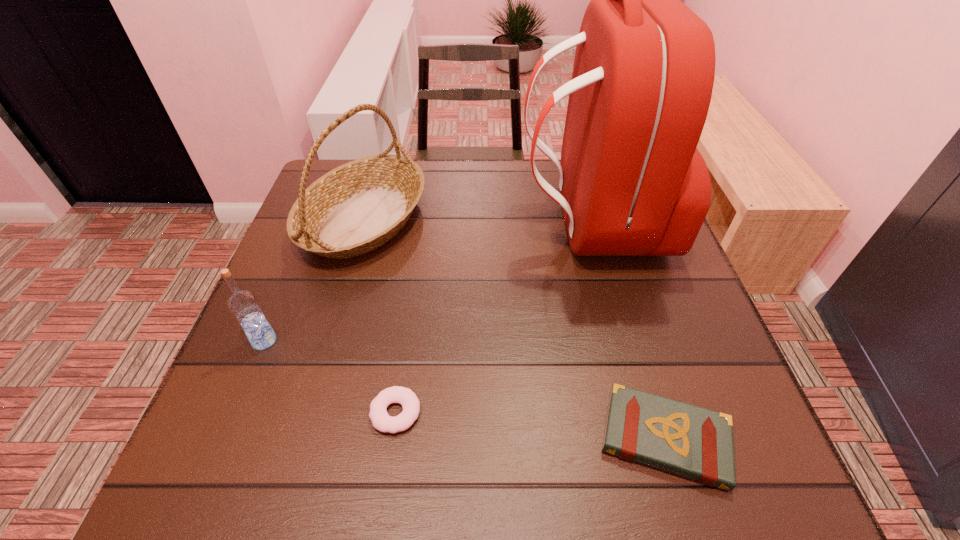
The image size is (960, 540). I want to click on object present at the far left corner, so click(x=357, y=207).

The height and width of the screenshot is (540, 960). Find the location of `object at the far right corner`. object at the far right corner is located at coordinates (632, 183).

Where is `object located in the near right corner section of the desktop`? The height and width of the screenshot is (540, 960). object located in the near right corner section of the desktop is located at coordinates (693, 442).

This screenshot has height=540, width=960. Find the location of `vacant space at the far edge`. vacant space at the far edge is located at coordinates (458, 205).

The height and width of the screenshot is (540, 960). Identify the location of vacant area at the near edge of the desktop. (445, 480).

The image size is (960, 540). In the image, there is a desktop. What are the coordinates of `vacant space at the left edge` in the screenshot? It's located at (296, 273).

Where is `vacant space at the right edge`? This screenshot has width=960, height=540. vacant space at the right edge is located at coordinates (629, 284).

Identify the location of free space at the near left corner of the desktop. (205, 459).

Locate an element on the screen. free space at the near right corner of the desktop is located at coordinates (742, 480).

I want to click on free space between the vodka and the doughnut, so click(330, 376).